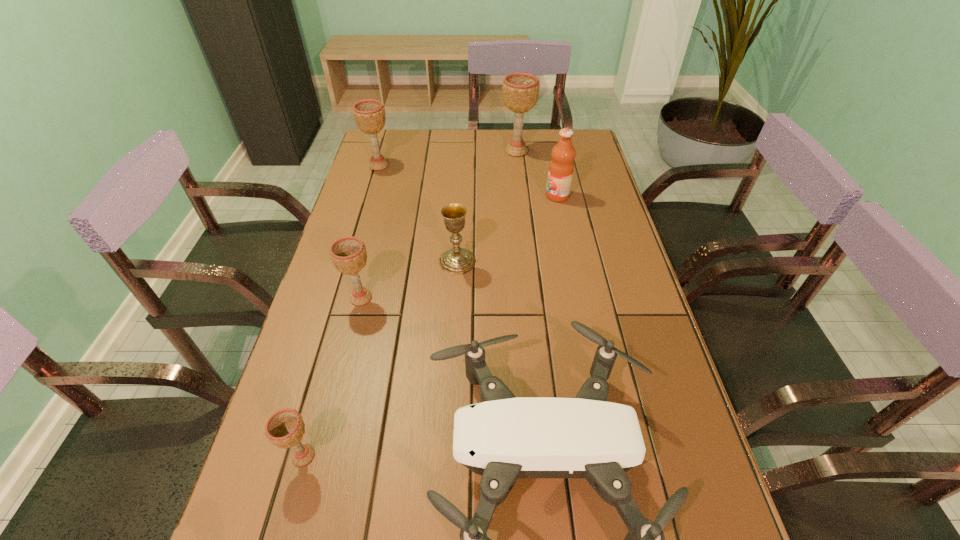
You are a GUI agent. You are given a task and a screenshot of the screen. Output one action in this format:
    pyautogui.click(x=<x>, y=<y>)
    Task: Click on the free space at the far edge of the desktop
    This screenshot has height=540, width=960.
    Given the screenshot: What is the action you would take?
    pyautogui.click(x=538, y=139)

At what (x,y) coordinates should I click in order to perform the action: click on free spot at the left edge of the desktop. Please return your answer as a coordinate pair (x, y). The image size is (960, 540). Looking at the image, I should click on (371, 289).

Find the location of a particular element. Image resolution: width=960 pixels, height=540 pixels. vacant region at the right edge of the desktop is located at coordinates (649, 439).

You are a GUI agent. You are given a task and a screenshot of the screen. Output one action in this format:
    pyautogui.click(x=<x>, y=<y>)
    Task: Click on the vacant space at the far left corner of the desktop
    The height and width of the screenshot is (540, 960).
    Given the screenshot: What is the action you would take?
    pyautogui.click(x=413, y=137)

Where is `vacant point at the far right corner`? vacant point at the far right corner is located at coordinates (550, 132).

Where is `free spot between the second tallest chalice and the fruit juice`? free spot between the second tallest chalice and the fruit juice is located at coordinates (468, 180).

The height and width of the screenshot is (540, 960). In order to click on free area in between the third farthest chalice and the third smallest beige chalice in this screenshot , I will do `click(419, 213)`.

You are a GUI agent. You are given a task and a screenshot of the screen. Output one action in this format:
    pyautogui.click(x=<x>, y=<y>)
    Task: Click on the vacant area that lies between the biggest beige chalice and the fruit juice
    
    Given the screenshot: What is the action you would take?
    pyautogui.click(x=537, y=173)

Find the location of a particular element. free point between the nearest beige chalice and the fourth farthest chalice is located at coordinates (332, 376).

Locate an element on the screen. This screenshot has height=540, width=960. empty location between the fourth farthest chalice and the second chalice from right to left is located at coordinates (409, 280).